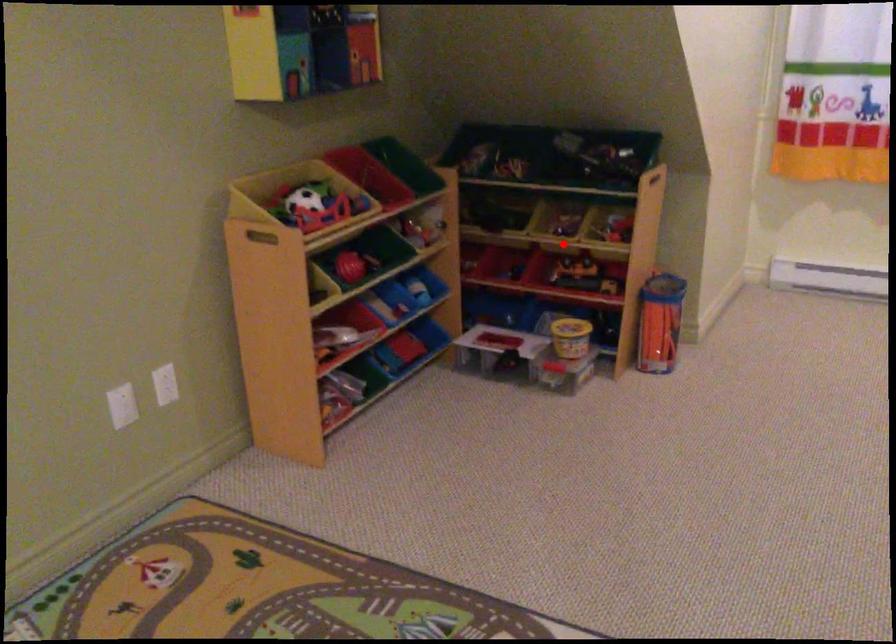
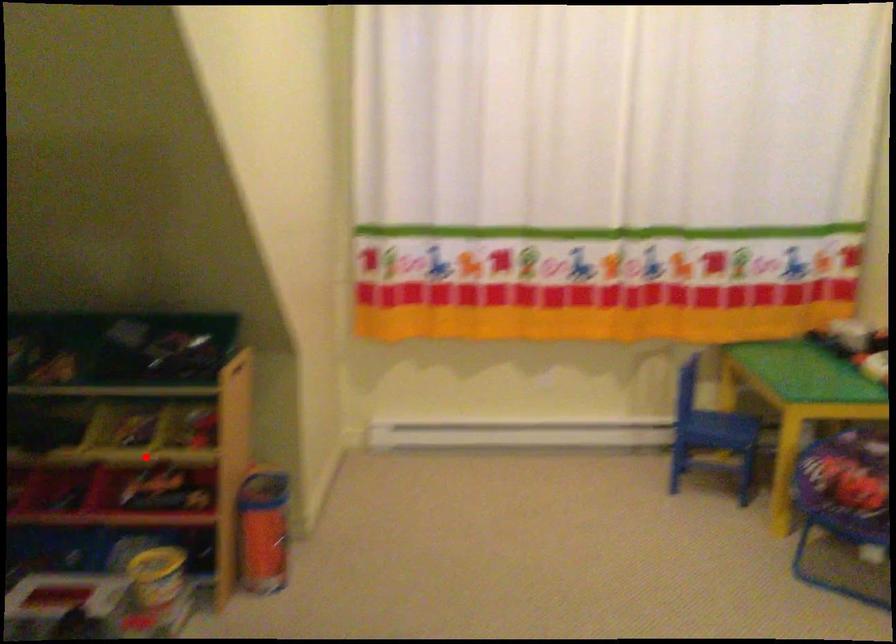
I am providing you with two images of the same scene from different viewpoints. A red point is marked on the first image and another point is marked on the second image. Do the highlighted points in image1 and image2 indicate the same real-world spot?

Yes